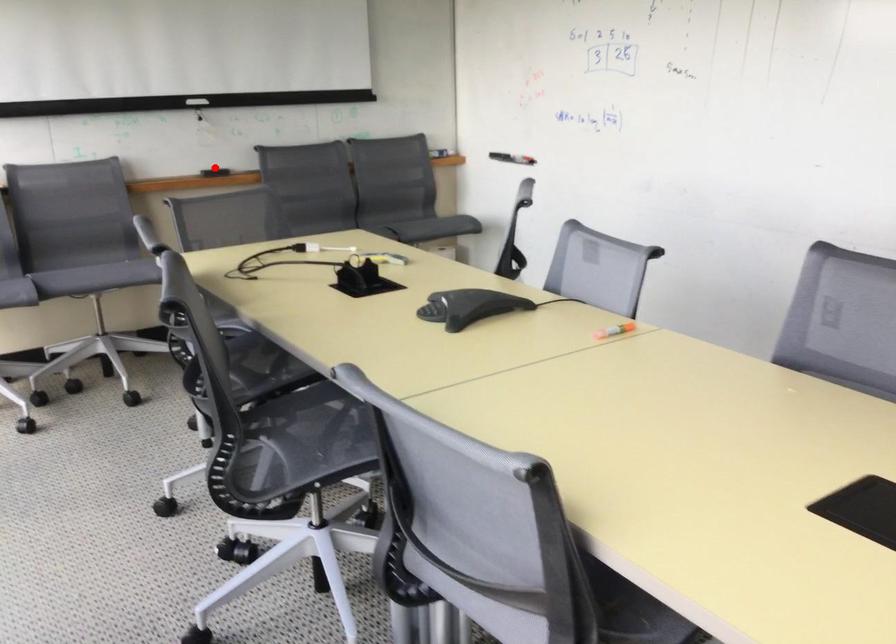
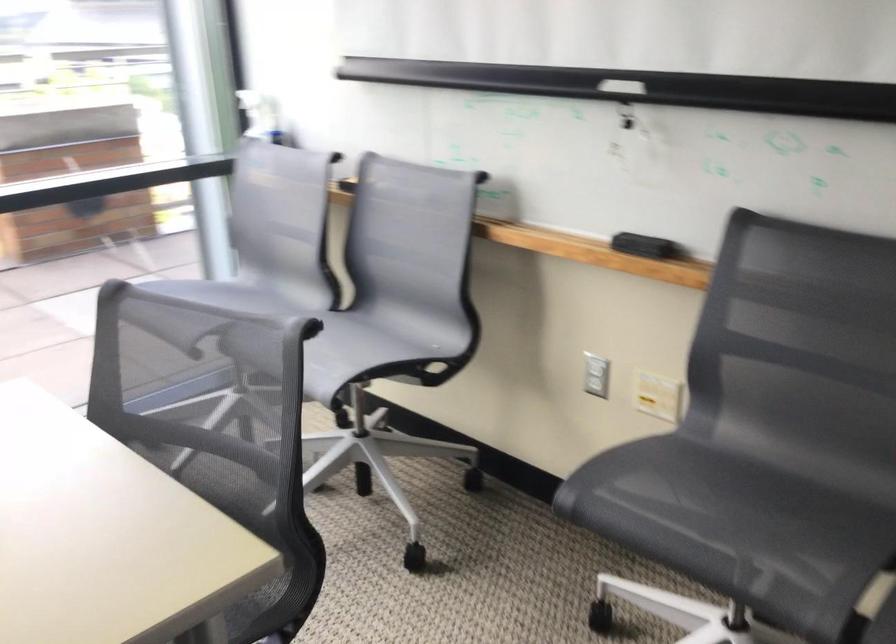
In the second image, find the point that corresponds to the highlighted location in the first image.

(643, 245)